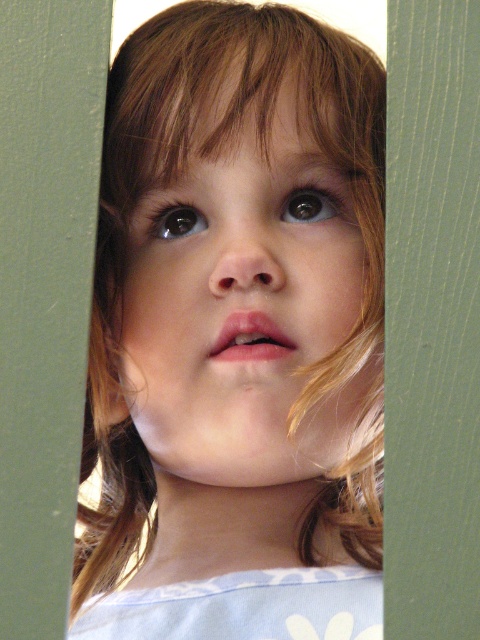
Consider the image. Is smooth blonde hair at center below green matte door at center?

Incorrect, smooth blonde hair at center is not positioned below green matte door at center.

Between smooth blonde hair at center and green matte door at center, which one has more height?

With more height is smooth blonde hair at center.

The image size is (480, 640). I want to click on smooth blonde hair at center, so click(x=237, y=333).

You are a GUI agent. You are given a task and a screenshot of the screen. Output one action in this format:
    pyautogui.click(x=<x>, y=<y>)
    Task: Click on the smooth blonde hair at center
    
    Given the screenshot: What is the action you would take?
    pyautogui.click(x=237, y=333)